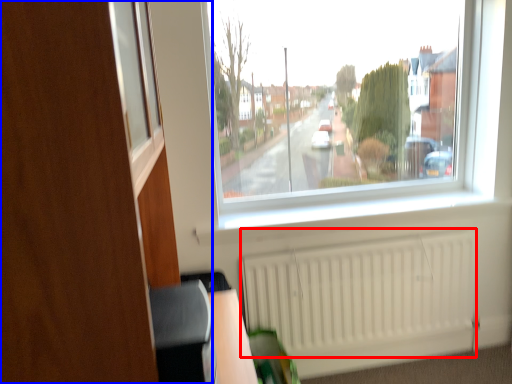
Question: Which object appears closest to the camera in this image, radiator (highlighted by a red box) or dresser (highlighted by a blue box)?

Choices:
 (A) radiator
 (B) dresser

Answer: (B)